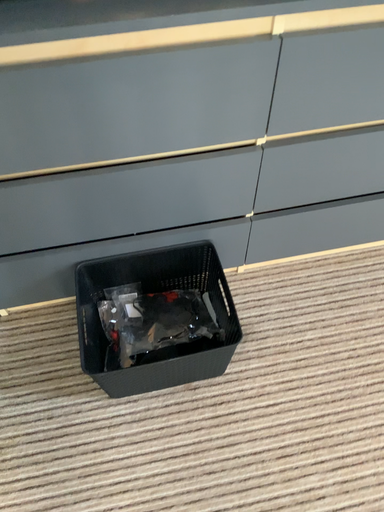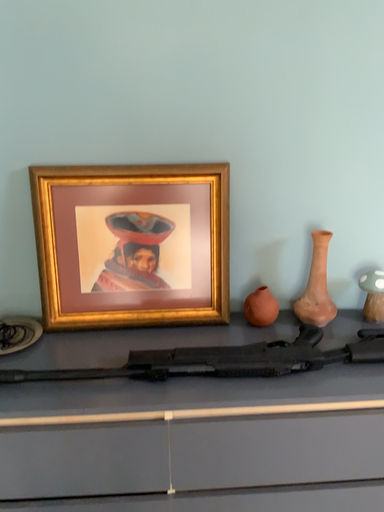
Question: How did the camera likely rotate when shooting the video?

Choices:
 (A) rotated downward
 (B) rotated upward

Answer: (B)